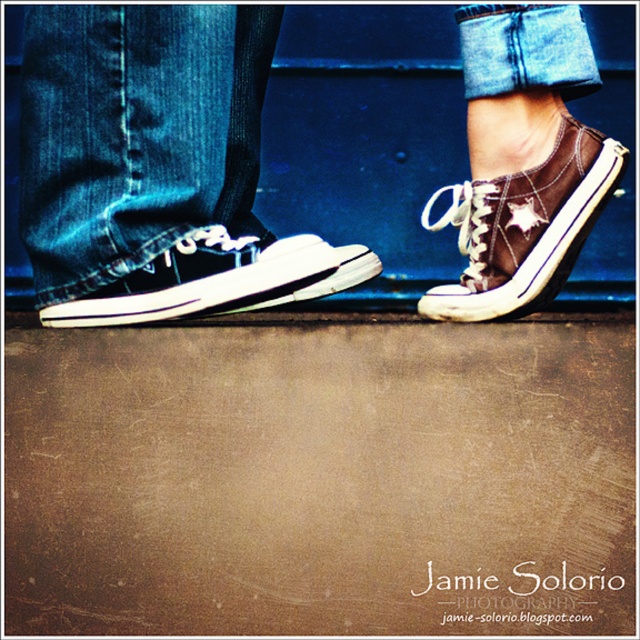
You are standing 3.66 feet away from a point marked at coordinates point (44, 74). You want to place a small object exactly at that point. Considering the scene described, where should you place the object relative to the black sneaker with white soles and laces?

The point (44, 74) is 3.66 feet away from you. Since the black sneaker with white soles and laces is on the left side, the object should be placed to the left of the black sneaker with white soles and laces.

You are trying to decide which shoe to wear for a hike. You have the brown canvas shoe at right and the matte black sneaker at center. Based on their thickness, which one might provide better support for rocky terrain?

The matte black sneaker at center is thicker than the brown canvas shoe at right, so it might provide better support for rocky terrain.

You are a delivery robot that needs to move between the matte black sneakers at lower left and the brown canvas shoe at right. The minimum distance required for your path is 5 inches. Can you safely navigate through this space?

The matte black sneakers at lower left is 4.92 inches away from brown canvas shoe at right. Since the distance is less than the required 5 inches, the robot cannot safely navigate through this space.